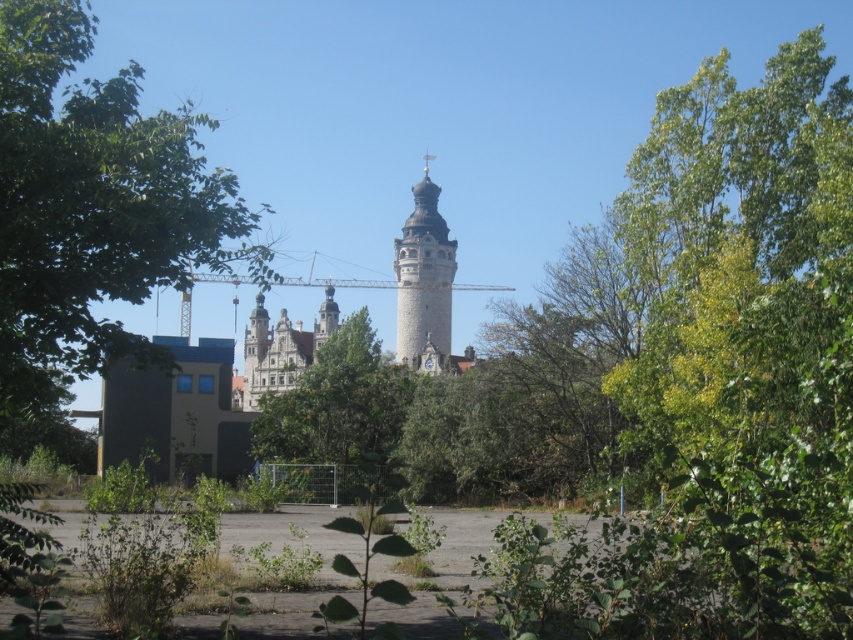
From the picture: Between green leafy tree at center and stone tower at center, which one has less height?

Standing shorter between the two is green leafy tree at center.

Is point (276, 436) less distant than point (398, 339)?

No, it is behind (398, 339).

Locate an element on the screen. green leafy tree at center is located at coordinates (339, 413).

Is green leafy tree at left above stone tower at center?

Yes, green leafy tree at left is above stone tower at center.

Between green leafy tree at left and stone tower at center, which one appears on the left side from the viewer's perspective?

Positioned to the left is green leafy tree at left.

Who is more forward, (80, 154) or (431, 294)?

Point (80, 154) is in front.

Where is `green leafy tree at left`? green leafy tree at left is located at coordinates (93, 208).

Between green leafy tree at left and green leafy tree at center, which one has more height?

With more height is green leafy tree at left.

Between green leafy tree at left and green leafy tree at center, which one is positioned lower?

green leafy tree at center is below.

The image size is (853, 640). Describe the element at coordinates (93, 208) in the screenshot. I see `green leafy tree at left` at that location.

What are the coordinates of `green leafy tree at left` in the screenshot? It's located at (93, 208).